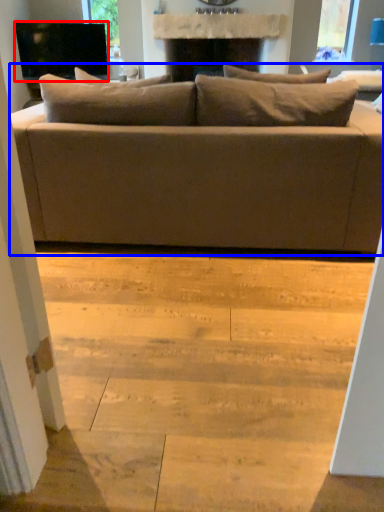
Question: Which of the following is the closest to the observer, television (highlighted by a red box) or studio couch (highlighted by a blue box)?

Choices:
 (A) television
 (B) studio couch

Answer: (B)